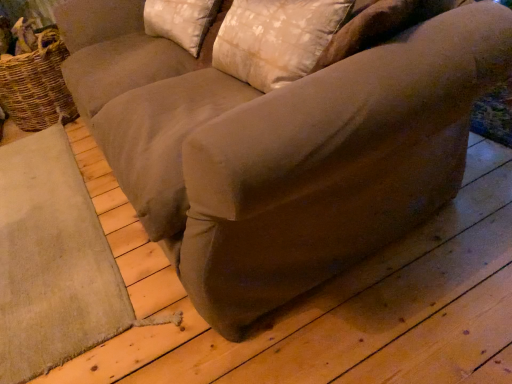
Question: Considering the relative sizes of woven brown basket at left and satin beige pillow at upper center, arranged as the 2th pillow when viewed from the back, in the image provided, is woven brown basket at left smaller than satin beige pillow at upper center, arranged as the 2th pillow when viewed from the back,?

Choices:
 (A) no
 (B) yes

Answer: (A)

Question: Is satin beige pillow at upper center, arranged as the 2th pillow when viewed from the back, a part of woven brown basket at left?

Choices:
 (A) yes
 (B) no

Answer: (B)

Question: Does woven brown basket at left come behind satin beige pillow at upper center, the 1th pillow viewed from the front?

Choices:
 (A) no
 (B) yes

Answer: (B)

Question: Could you tell me if woven brown basket at left is turned towards satin beige pillow at upper center, arranged as the 2th pillow when viewed from the back?

Choices:
 (A) yes
 (B) no

Answer: (A)

Question: Considering the relative positions of woven brown basket at left and satin beige pillow at upper center, the 1th pillow viewed from the front, in the image provided, is woven brown basket at left to the right of satin beige pillow at upper center, the 1th pillow viewed from the front, from the viewer's perspective?

Choices:
 (A) yes
 (B) no

Answer: (B)

Question: Do you think beige fabric pillow at upper center, marked as the first pillow in a back-to-front arrangement, is within satin beige pillow at upper center, arranged as the 2th pillow when viewed from the back, or outside of it?

Choices:
 (A) outside
 (B) inside

Answer: (A)

Question: From a real-world perspective, is beige fabric pillow at upper center, which ranks as the 2th pillow in front-to-back order, above or below satin beige pillow at upper center, the 1th pillow viewed from the front?

Choices:
 (A) below
 (B) above

Answer: (A)

Question: Is point (159, 34) closer or farther from the camera than point (313, 3)?

Choices:
 (A) farther
 (B) closer

Answer: (A)

Question: Relative to satin beige pillow at upper center, the 1th pillow viewed from the front, is beige fabric pillow at upper center, marked as the first pillow in a back-to-front arrangement, in front or behind?

Choices:
 (A) front
 (B) behind

Answer: (B)

Question: From a real-world perspective, is woven brown basket at left above or below satin beige pillow at upper center, arranged as the 2th pillow when viewed from the back?

Choices:
 (A) below
 (B) above

Answer: (A)

Question: Is woven brown basket at left bigger or smaller than satin beige pillow at upper center, arranged as the 2th pillow when viewed from the back?

Choices:
 (A) small
 (B) big

Answer: (B)

Question: Based on their positions, is woven brown basket at left located to the left or right of satin beige pillow at upper center, the 1th pillow viewed from the front?

Choices:
 (A) left
 (B) right

Answer: (A)

Question: Considering the positions of woven brown basket at left and satin beige pillow at upper center, arranged as the 2th pillow when viewed from the back, in the image, is woven brown basket at left taller or shorter than satin beige pillow at upper center, arranged as the 2th pillow when viewed from the back,?

Choices:
 (A) tall
 (B) short

Answer: (A)

Question: From the image's perspective, is satin beige pillow at upper center, arranged as the 2th pillow when viewed from the back, positioned above or below beige fabric pillow at upper center, which ranks as the 2th pillow in front-to-back order?

Choices:
 (A) above
 (B) below

Answer: (B)

Question: From a real-world perspective, is satin beige pillow at upper center, arranged as the 2th pillow when viewed from the back, physically located above or below beige fabric pillow at upper center, which ranks as the 2th pillow in front-to-back order?

Choices:
 (A) above
 (B) below

Answer: (A)